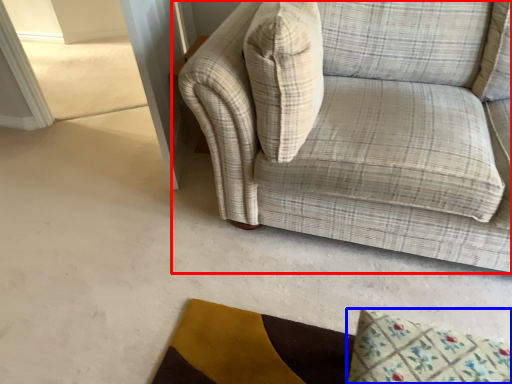
Question: Which object is further to the camera taking this photo, studio couch (highlighted by a red box) or mat (highlighted by a blue box)?

Choices:
 (A) studio couch
 (B) mat

Answer: (B)